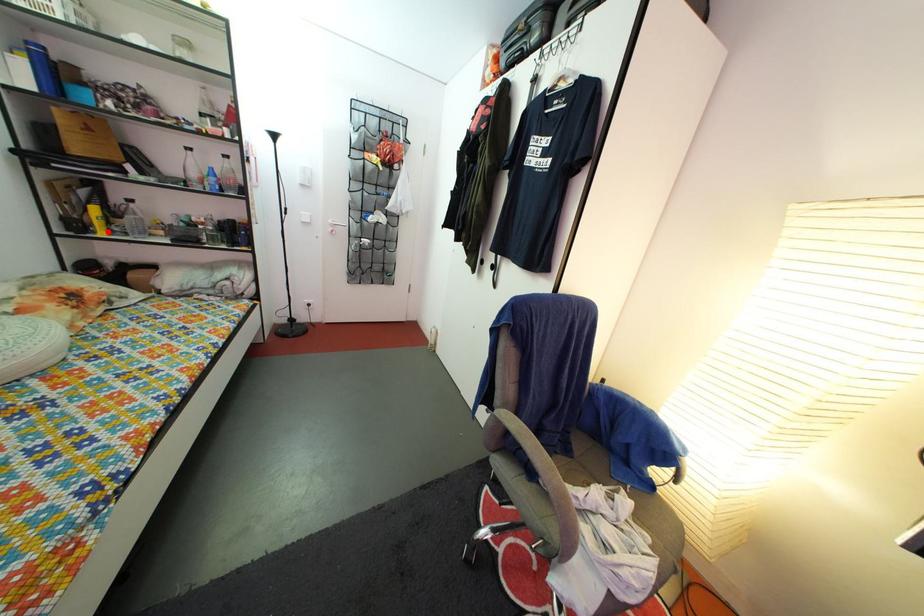
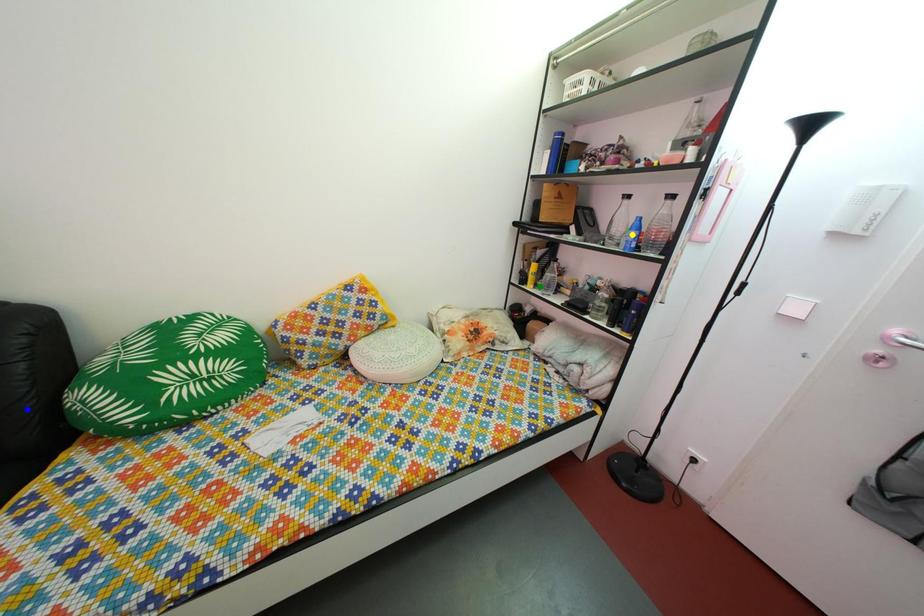
Question: I am providing you with two images of the same scene from different viewpoints. A red point is marked on the first image. You are given multiple points on the second image. Which point in image 2 is actually the same real-world point as the red point in image 1?

Choices:
 (A) blue point
 (B) green point
 (C) yellow point

Answer: (B)